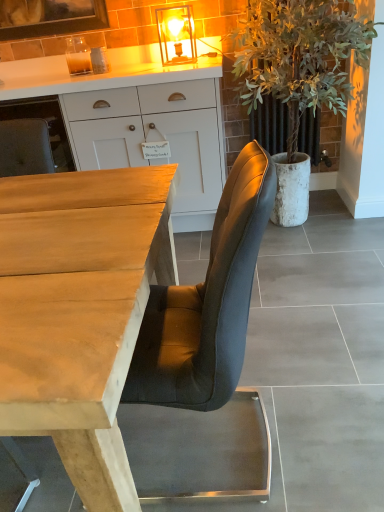
Question: Is wooden desk at center thinner than smooth gray concrete at center?

Choices:
 (A) yes
 (B) no

Answer: (B)

Question: From a real-world perspective, is wooden desk at center located higher than smooth gray concrete at center?

Choices:
 (A) no
 (B) yes

Answer: (A)

Question: Can you confirm if wooden desk at center is wider than smooth gray concrete at center?

Choices:
 (A) yes
 (B) no

Answer: (A)

Question: Is wooden desk at center at the right side of smooth gray concrete at center?

Choices:
 (A) yes
 (B) no

Answer: (B)

Question: Would you say wooden desk at center is a long distance from smooth gray concrete at center?

Choices:
 (A) no
 (B) yes

Answer: (A)

Question: Can we say wooden desk at center lies outside smooth gray concrete at center?

Choices:
 (A) no
 (B) yes

Answer: (B)

Question: Is white matte cabinet at upper center not close to green leafy plant at right?

Choices:
 (A) no
 (B) yes

Answer: (A)

Question: Is green leafy plant at right completely or partially inside white matte cabinet at upper center?

Choices:
 (A) no
 (B) yes

Answer: (A)

Question: Does white matte cabinet at upper center lie in front of green leafy plant at right?

Choices:
 (A) yes
 (B) no

Answer: (B)

Question: From the image's perspective, is white matte cabinet at upper center over green leafy plant at right?

Choices:
 (A) no
 (B) yes

Answer: (A)

Question: From the image's perspective, is white matte cabinet at upper center beneath green leafy plant at right?

Choices:
 (A) yes
 (B) no

Answer: (A)

Question: Considering the relative positions of white matte cabinet at upper center and green leafy plant at right in the image provided, is white matte cabinet at upper center to the left of green leafy plant at right from the viewer's perspective?

Choices:
 (A) yes
 (B) no

Answer: (A)

Question: Is wooden desk at center taller than green leafy plant at right?

Choices:
 (A) no
 (B) yes

Answer: (A)